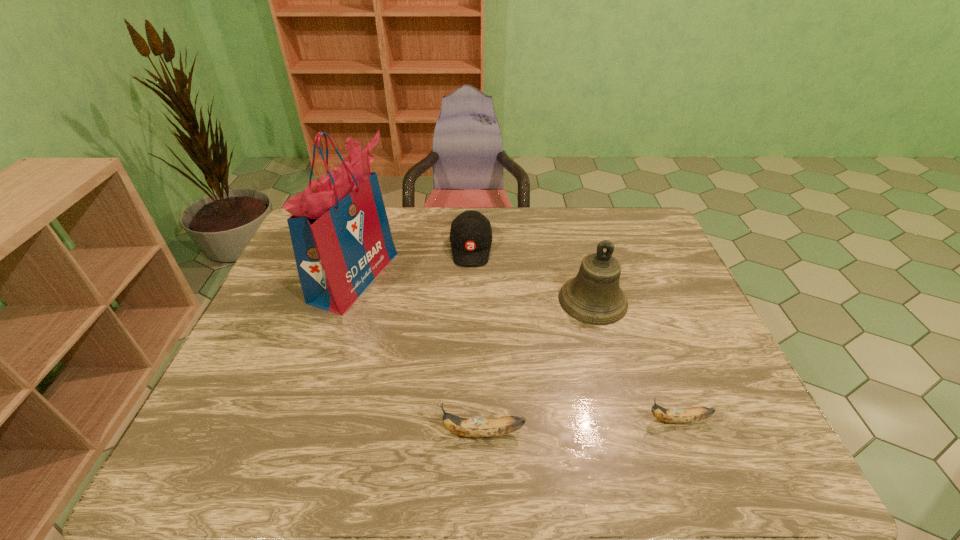
Where is `object positioned at the right edge`? The height and width of the screenshot is (540, 960). object positioned at the right edge is located at coordinates (695, 414).

I want to click on object located in the far left corner section of the desktop, so click(340, 233).

In order to click on free space at the far edge of the desktop in this screenshot , I will do `click(597, 238)`.

Where is `vacant region at the near edge of the desktop`? The height and width of the screenshot is (540, 960). vacant region at the near edge of the desktop is located at coordinates (594, 454).

The height and width of the screenshot is (540, 960). In the image, there is a desktop. What are the coordinates of `vacant space at the left edge` in the screenshot? It's located at (278, 284).

The height and width of the screenshot is (540, 960). In the image, there is a desktop. What are the coordinates of `free space at the right edge` in the screenshot? It's located at (652, 257).

The image size is (960, 540). I want to click on blank space at the near left corner, so click(203, 462).

Where is `blank space at the far right corner of the desktop`? This screenshot has width=960, height=540. blank space at the far right corner of the desktop is located at coordinates (x=630, y=222).

The height and width of the screenshot is (540, 960). I want to click on vacant space at the near right corner of the desktop, so click(x=699, y=453).

Identify the location of vacant point located between the bell and the shortest object. The width and height of the screenshot is (960, 540). (636, 360).